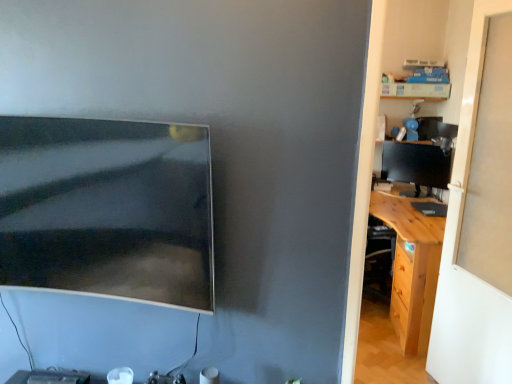
Question: Should I look upward or downward to see matte black monitor at right, marked as the 2th computer monitor in a front-to-back arrangement?

Choices:
 (A) down
 (B) up

Answer: (B)

Question: Does light brown wood desk at right turn towards wooden desk at right?

Choices:
 (A) yes
 (B) no

Answer: (B)

Question: From a real-world perspective, is light brown wood desk at right positioned over wooden desk at right based on gravity?

Choices:
 (A) no
 (B) yes

Answer: (A)

Question: Considering the relative sizes of light brown wood desk at right and wooden desk at right in the image provided, is light brown wood desk at right smaller than wooden desk at right?

Choices:
 (A) yes
 (B) no

Answer: (B)

Question: Is wooden desk at right inside light brown wood desk at right?

Choices:
 (A) yes
 (B) no

Answer: (B)

Question: From a real-world perspective, is light brown wood desk at right under wooden desk at right?

Choices:
 (A) no
 (B) yes

Answer: (B)

Question: Is light brown wood desk at right in contact with wooden desk at right?

Choices:
 (A) no
 (B) yes

Answer: (A)

Question: Is matte black monitor at right, placed as the second computer monitor when sorted from left to right, outside wooden desk at right?

Choices:
 (A) yes
 (B) no

Answer: (A)

Question: Considering the relative sizes of matte black monitor at right, placed as the second computer monitor when sorted from left to right, and wooden desk at right in the image provided, is matte black monitor at right, placed as the second computer monitor when sorted from left to right, shorter than wooden desk at right?

Choices:
 (A) yes
 (B) no

Answer: (A)

Question: Is matte black monitor at right, the 1th computer monitor positioned from the right, thinner than wooden desk at right?

Choices:
 (A) no
 (B) yes

Answer: (B)

Question: From the image's perspective, does matte black monitor at right, marked as the 2th computer monitor in a front-to-back arrangement, appear higher than wooden desk at right?

Choices:
 (A) yes
 (B) no

Answer: (A)

Question: Is matte black monitor at right, placed as the second computer monitor when sorted from left to right, aimed at wooden desk at right?

Choices:
 (A) yes
 (B) no

Answer: (A)

Question: Can you see matte black monitor at right, the 1th computer monitor positioned from the right, touching wooden desk at right?

Choices:
 (A) yes
 (B) no

Answer: (B)

Question: Can you confirm if wooden desk at right is shorter than light brown wood desk at right?

Choices:
 (A) no
 (B) yes

Answer: (A)